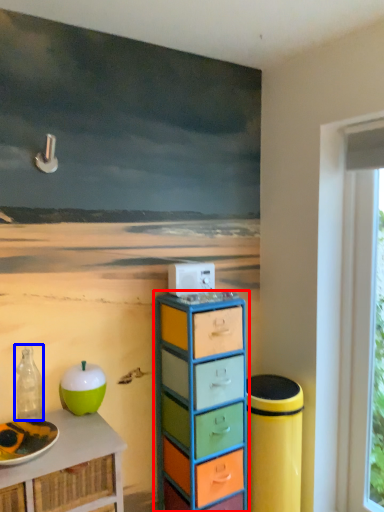
Question: Which object is further to the camera taking this photo, chest of drawers (highlighted by a red box) or bottle (highlighted by a blue box)?

Choices:
 (A) chest of drawers
 (B) bottle

Answer: (A)